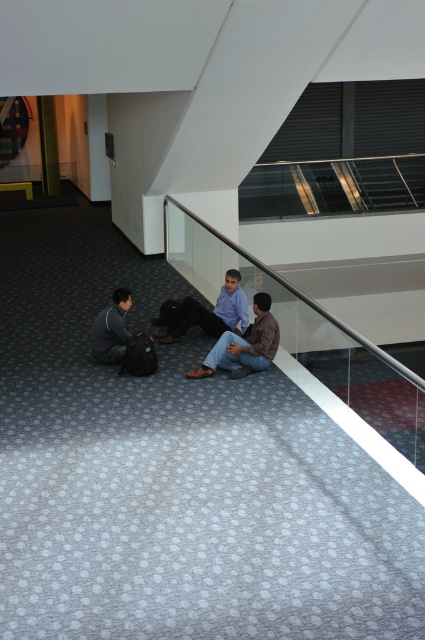
Question: Is brown leather jacket at center wider than blue shirt at center?

Choices:
 (A) no
 (B) yes

Answer: (A)

Question: Is transparent glass escalator at lower center smaller than blue shirt at center?

Choices:
 (A) yes
 (B) no

Answer: (A)

Question: Which point is closer to the camera?

Choices:
 (A) transparent glass escalator at lower center
 (B) dark gray fabric jacket at lower left

Answer: (B)

Question: Which object is the farthest from the carpeted floor at lower center?

Choices:
 (A) blue shirt at center
 (B) brown leather jacket at center
 (C) dark gray fabric jacket at lower left

Answer: (C)

Question: Which point is farther to the camera?

Choices:
 (A) dark gray fabric jacket at lower left
 (B) blue shirt at center
 (C) carpeted floor at lower center
 (D) transparent glass escalator at lower center

Answer: (B)

Question: In this image, where is carpeted floor at lower center located relative to transparent glass escalator at lower center?

Choices:
 (A) left
 (B) right

Answer: (A)